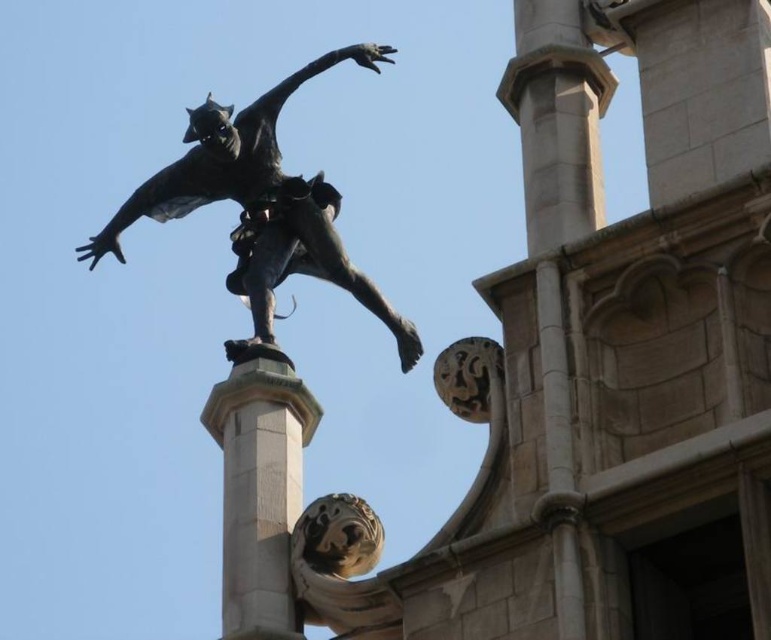
You are an art conservator assessing the stability of the bronze statue at upper center and the smooth stone pillar at center. Based on their widths, which object might require additional structural support to prevent imbalance?

The bronze statue at upper center might require additional structural support because it might be wider than the smooth stone pillar at center, potentially causing an imbalance if not secured properly.

You are an art conservator assessing the placement of the bronze statue at upper center and the smooth stone pillar at center. Which object is closer to your viewpoint?

The bronze statue at upper center is closer to the viewer than the smooth stone pillar at center.